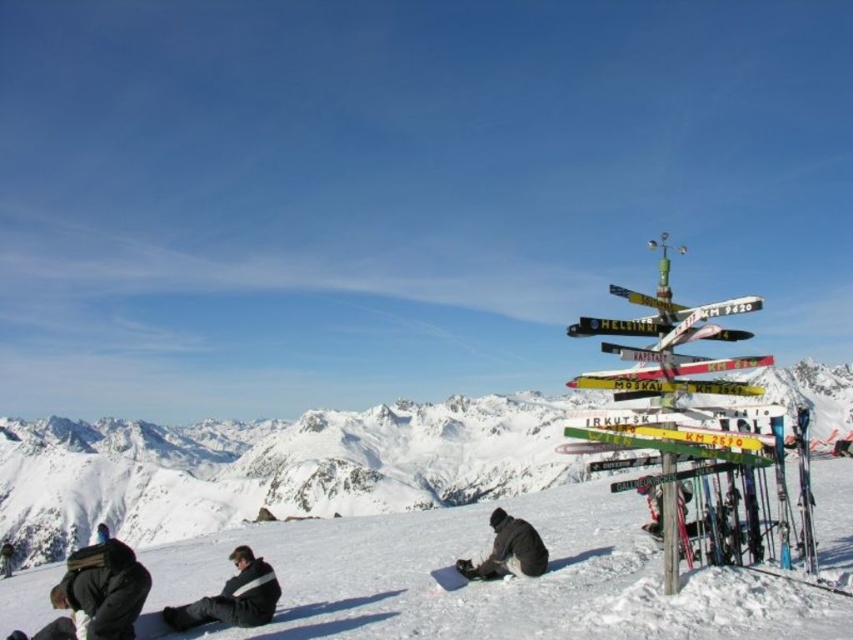
You are a drone operator trying to capture the white snow mountain at center from above. What coordinates should you aim for to ensure the drone is directly above it?

The white snow mountain at center is located at coordinates point (271, 467), so the drone should aim for those coordinates to be directly above it.

You are standing at the base of the white snow mountain at center and want to reach the dark gray jacket at lower center. Which direction should you move to get closer to the jacket?

The white snow mountain at center is below the dark gray jacket at lower center, so you should move downward towards the white snow mountain at center to reach the jacket.